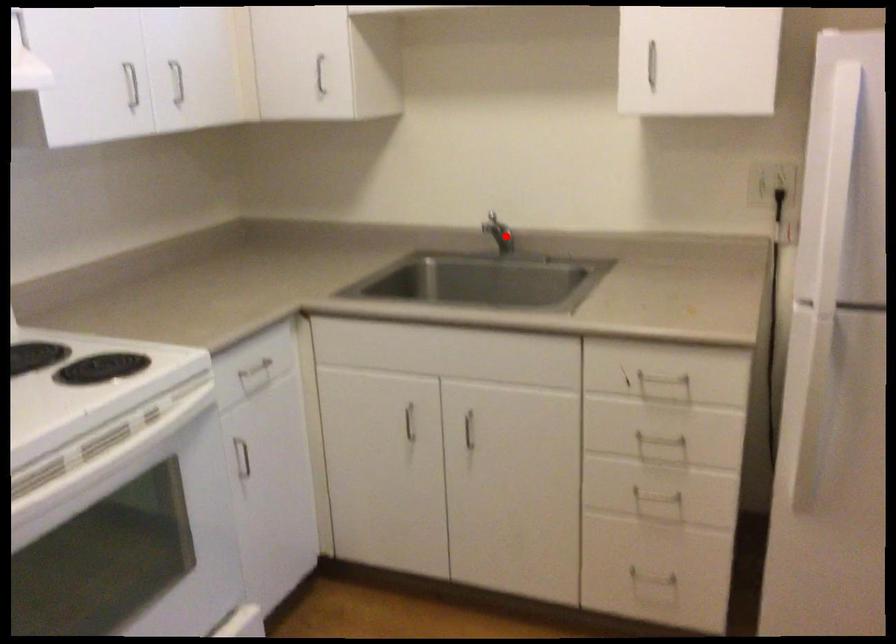
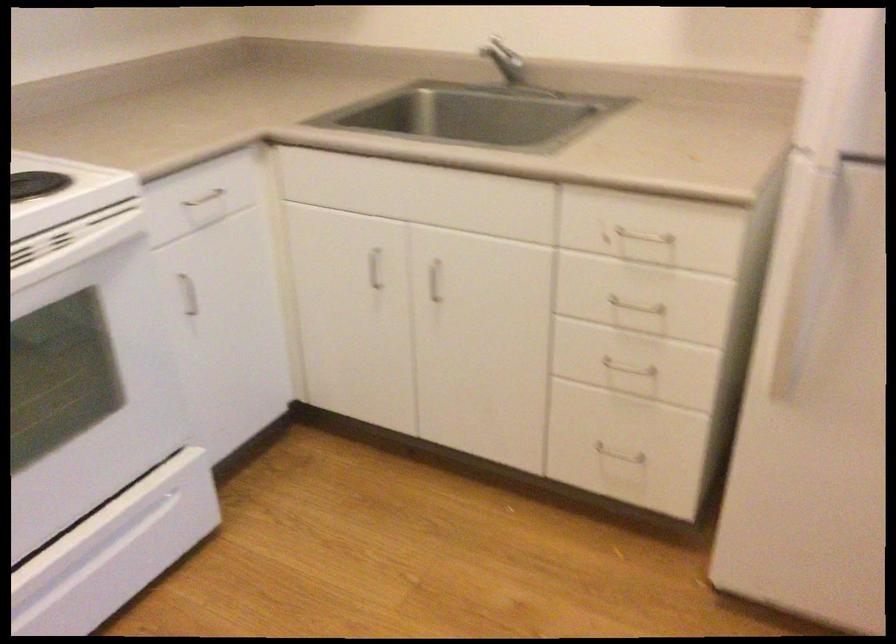
Question: I am providing you with two images of the same scene from different viewpoints. Image1 has a red point marked. In image2, the corresponding 3D location appears at what relative position? Reply with the corresponding letter.

Choices:
 (A) Closer
 (B) Farther

Answer: (A)